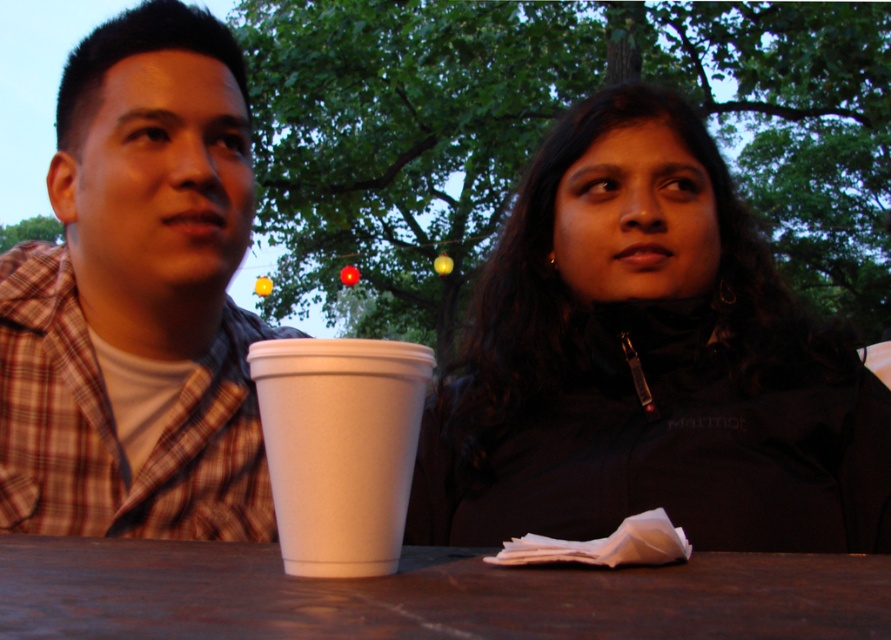
You are a photographer setting up a shot of the two people at the table. You want to ensure the plaid shirt at left and the brown wooden table at center are both in focus. Which object should you focus on first to ensure both are sharp?

The plaid shirt at left is positioned over the brown wooden table at center, so focusing on the plaid shirt at left first will ensure both are in focus since it is closer to the camera.

You are standing at the point with coordinates point (496, 582) and want to walk to the point with coordinates point (45, 390). However, there is an obstacle blocking your path. Which direction should you move to avoid it?

Since point (45, 390) is behind point (496, 582), you should move forward towards the direction of point (45, 390) to avoid the obstacle.

You are a photographer trying to capture a closeup of the black matte jacket at center and the white styrofoam cup at center. From the perspective of the photographer standing behind the table, which object should you adjust your camera to focus on first if you want to ensure both are in frame?

The black matte jacket at center should be focused on first since it is positioned to the right of the white styrofoam cup at center, so adjusting focus starting from the cup and moving right would capture both.